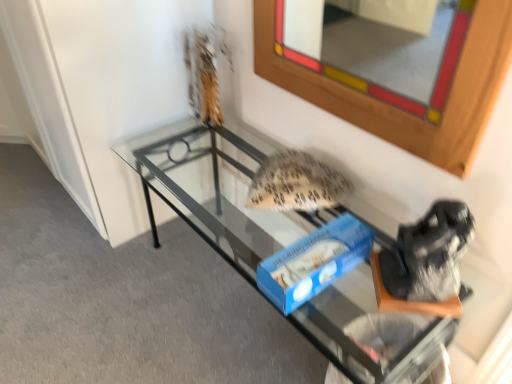
This screenshot has height=384, width=512. Identify the location of transparent glass table at center. (221, 189).

Describe the element at coordinates (221, 189) in the screenshot. The height and width of the screenshot is (384, 512). I see `transparent glass table at center` at that location.

What is the approximate height of transparent glass table at center?

transparent glass table at center is 15.73 inches tall.

You are a GUI agent. You are given a task and a screenshot of the screen. Output one action in this format:
    pyautogui.click(x=<x>, y=<y>)
    Task: Click on the wooden frame at upper center
    The width and height of the screenshot is (512, 384).
    Given the screenshot: What is the action you would take?
    pyautogui.click(x=376, y=49)

Describe the element at coordinates (376, 49) in the screenshot. Image resolution: width=512 pixels, height=384 pixels. I see `wooden frame at upper center` at that location.

Find the location of `transparent glass table at center`. transparent glass table at center is located at coordinates (221, 189).

Does transparent glass table at center appear on the right side of wooden frame at upper center?

Incorrect, transparent glass table at center is not on the right side of wooden frame at upper center.

Between transparent glass table at center and wooden frame at upper center, which one is positioned behind?

transparent glass table at center is behind.

Is point (259, 247) farther from viewer compared to point (432, 80)?

No.

From the image's perspective, is transparent glass table at center beneath wooden frame at upper center?

Yes, from the image's perspective, transparent glass table at center is below wooden frame at upper center.

From a real-world perspective, between transparent glass table at center and wooden frame at upper center, who is vertically lower?

In real-world perspective, transparent glass table at center is lower.

Considering the sizes of objects transparent glass table at center and wooden frame at upper center in the image provided, who is wider, transparent glass table at center or wooden frame at upper center?

transparent glass table at center.

Does transparent glass table at center have a lesser height compared to wooden frame at upper center?

Indeed, transparent glass table at center has a lesser height compared to wooden frame at upper center.

In terms of size, does transparent glass table at center appear bigger or smaller than wooden frame at upper center?

In the image, transparent glass table at center appears to be larger than wooden frame at upper center.

Is wooden frame at upper center inside transparent glass table at center?

Actually, wooden frame at upper center is outside transparent glass table at center.

Can you see transparent glass table at center touching wooden frame at upper center?

transparent glass table at center is not next to wooden frame at upper center, and they're not touching.

Is transparent glass table at center positioned with its back to wooden frame at upper center?

transparent glass table at center is not turned away from wooden frame at upper center.

Identify the location of mirror that is above the transparent glass table at center (from a real-world perspective). (376, 49).

Is wooden frame at upper center to the left or to the right of transparent glass table at center in the image?

Clearly, wooden frame at upper center is on the right of transparent glass table at center in the image.

From the picture: Is wooden frame at upper center in front of or behind transparent glass table at center in the image?

Visually, wooden frame at upper center is located in front of transparent glass table at center.

Considering the points (437, 102) and (306, 328), which point is behind, point (437, 102) or point (306, 328)?

The point (306, 328) is farther.

From the image's perspective, between wooden frame at upper center and transparent glass table at center, which one is located above?

From the image's view, wooden frame at upper center is above.

Looking at this image, from a real-world perspective, is wooden frame at upper center above or below transparent glass table at center?

From a real-world perspective, wooden frame at upper center is physically above transparent glass table at center.

Can you confirm if wooden frame at upper center is wider than transparent glass table at center?

Incorrect, the width of wooden frame at upper center does not surpass that of transparent glass table at center.

In terms of height, does wooden frame at upper center look taller or shorter compared to transparent glass table at center?

wooden frame at upper center is taller than transparent glass table at center.

Is wooden frame at upper center smaller than transparent glass table at center?

Correct, wooden frame at upper center occupies less space than transparent glass table at center.

Is wooden frame at upper center situated inside transparent glass table at center or outside?

wooden frame at upper center is not inside transparent glass table at center, it's outside.

Is wooden frame at upper center not close to transparent glass table at center?

wooden frame at upper center is positioned a significant distance from transparent glass table at center.

Is wooden frame at upper center looking in the opposite direction of transparent glass table at center?

That's not correct — wooden frame at upper center is not looking away from transparent glass table at center.

I want to click on mirror lying on the right of transparent glass table at center, so click(376, 49).

Where is `mirror on the right of transparent glass table at center`? mirror on the right of transparent glass table at center is located at coordinates (376, 49).

Identify the location of furniture on the left of wooden frame at upper center. The height and width of the screenshot is (384, 512). (221, 189).